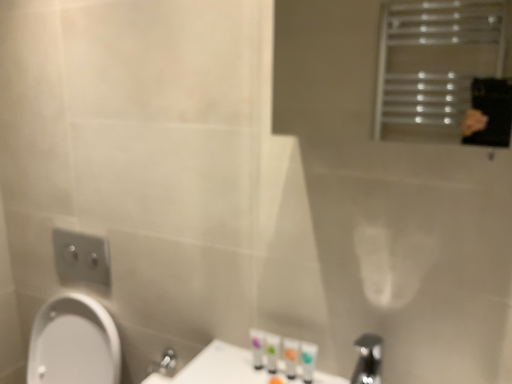
Describe the element at coordinates (434, 65) in the screenshot. The width and height of the screenshot is (512, 384). I see `metallic silver towel rack at upper right` at that location.

Measure the distance between metallic silver towel rack at upper right and camera.

metallic silver towel rack at upper right and camera are 4.90 feet apart from each other.

Locate an element on the screen. Image resolution: width=512 pixels, height=384 pixels. silver metallic tap at lower right is located at coordinates (368, 359).

The width and height of the screenshot is (512, 384). Describe the element at coordinates (272, 351) in the screenshot. I see `translucent plastic tubes at lower center, the 3th toiletry when ordered from right to left` at that location.

Locate an element on the screen. The image size is (512, 384). translucent plastic tubes at lower center, the second toiletry positioned from the right is located at coordinates (290, 357).

What is the approximate height of translucent plastic tubes at lower center, the second toiletry positioned from the right?

translucent plastic tubes at lower center, the second toiletry positioned from the right, is 3.80 inches in height.

The width and height of the screenshot is (512, 384). I want to click on white glossy tube at lower center, the first toiletry viewed from the right, so click(x=308, y=360).

From the picture: Is silver metallic tap at lower right placed right next to white glossy tube at lower center, the first toiletry viewed from the right?

No, silver metallic tap at lower right is not beside white glossy tube at lower center, the first toiletry viewed from the right.

Does silver metallic tap at lower right have a lesser height compared to white glossy tube at lower center, which ranks as the fourth toiletry in left-to-right order?

No.

Considering the relative sizes of silver metallic tap at lower right and white glossy tube at lower center, the first toiletry viewed from the right, in the image provided, is silver metallic tap at lower right bigger than white glossy tube at lower center, the first toiletry viewed from the right,?

Yes, silver metallic tap at lower right is bigger than white glossy tube at lower center, the first toiletry viewed from the right.

From the image's perspective, is silver metallic tap at lower right on white glossy tube at lower center, the first toiletry viewed from the right?

No, from the image's perspective, silver metallic tap at lower right is not on top of white glossy tube at lower center, the first toiletry viewed from the right.

Considering the relative sizes of translucent plastic tubes at lower center, the 2th toiletry in the left-to-right sequence, and white glossy tube at lower center, which ranks as the fourth toiletry in left-to-right order, in the image provided, is translucent plastic tubes at lower center, the 2th toiletry in the left-to-right sequence, taller than white glossy tube at lower center, which ranks as the fourth toiletry in left-to-right order,?

In fact, translucent plastic tubes at lower center, the 2th toiletry in the left-to-right sequence, may be shorter than white glossy tube at lower center, which ranks as the fourth toiletry in left-to-right order.

Is translucent plastic tubes at lower center, the 3th toiletry when ordered from right to left, oriented towards white glossy tube at lower center, the first toiletry viewed from the right?

No, translucent plastic tubes at lower center, the 3th toiletry when ordered from right to left, is not facing towards white glossy tube at lower center, the first toiletry viewed from the right.

From the image's perspective, would you say translucent plastic tubes at lower center, the 3th toiletry when ordered from right to left, is shown under white glossy tube at lower center, which ranks as the fourth toiletry in left-to-right order?

No, from the image's perspective, translucent plastic tubes at lower center, the 3th toiletry when ordered from right to left, is not below white glossy tube at lower center, which ranks as the fourth toiletry in left-to-right order.

Which of these two, metallic silver towel rack at upper right or translucent plastic tubes at lower center, acting as the 3th toiletry starting from the left, is smaller?

translucent plastic tubes at lower center, acting as the 3th toiletry starting from the left, is smaller.

Can you confirm if metallic silver towel rack at upper right is positioned to the right of translucent plastic tubes at lower center, the second toiletry positioned from the right?

Indeed, metallic silver towel rack at upper right is positioned on the right side of translucent plastic tubes at lower center, the second toiletry positioned from the right.

Between metallic silver towel rack at upper right and translucent plastic tubes at lower center, the second toiletry positioned from the right, which one is positioned in front?

metallic silver towel rack at upper right.

From a real-world perspective, is silver metallic tap at lower right below translucent plastic tubes at lower center, the 3th toiletry when ordered from right to left?

No, from a real-world perspective, silver metallic tap at lower right is not below translucent plastic tubes at lower center, the 3th toiletry when ordered from right to left.

Would you say silver metallic tap at lower right is outside translucent plastic tubes at lower center, the 3th toiletry when ordered from right to left?

Yes, silver metallic tap at lower right is not within translucent plastic tubes at lower center, the 3th toiletry when ordered from right to left.

Considering the sizes of silver metallic tap at lower right and translucent plastic tubes at lower center, the 3th toiletry when ordered from right to left, in the image, is silver metallic tap at lower right wider or thinner than translucent plastic tubes at lower center, the 3th toiletry when ordered from right to left,?

Considering their sizes, silver metallic tap at lower right looks broader than translucent plastic tubes at lower center, the 3th toiletry when ordered from right to left.

Is the surface of silver metallic tap at lower right in direct contact with translucent plastic tubes at lower center, the 3th toiletry when ordered from right to left?

There is a gap between silver metallic tap at lower right and translucent plastic tubes at lower center, the 3th toiletry when ordered from right to left.

Can you tell me how much translucent plastic tubes at lower center, the 3th toiletry when ordered from right to left, and translucent plastic tubes at lower center, acting as the 3th toiletry starting from the left, differ in facing direction?

3.1 degrees separate the facing orientations of translucent plastic tubes at lower center, the 3th toiletry when ordered from right to left, and translucent plastic tubes at lower center, acting as the 3th toiletry starting from the left.

Based on the photo, from the image's perspective, would you say translucent plastic tubes at lower center, the 2th toiletry in the left-to-right sequence, is shown under translucent plastic tubes at lower center, the second toiletry positioned from the right?

Actually, translucent plastic tubes at lower center, the 2th toiletry in the left-to-right sequence, appears above translucent plastic tubes at lower center, the second toiletry positioned from the right, in the image.

From the picture: Is translucent plastic tubes at lower center, the 2th toiletry in the left-to-right sequence, aimed at translucent plastic tubes at lower center, the second toiletry positioned from the right?

No, translucent plastic tubes at lower center, the 2th toiletry in the left-to-right sequence, is not oriented towards translucent plastic tubes at lower center, the second toiletry positioned from the right.

Is translucent plastic tubes at lower center, the 2th toiletry in the left-to-right sequence, wider than translucent plastic tubes at lower center, the second toiletry positioned from the right?

Yes.

Is translucent plastic tubes at lower center, the second toiletry positioned from the right, far away from translucent plastic bottles at lower center, acting as the 4th toiletry starting from the right?

No, translucent plastic tubes at lower center, the second toiletry positioned from the right, is in close proximity to translucent plastic bottles at lower center, acting as the 4th toiletry starting from the right.

Is translucent plastic tubes at lower center, acting as the 3th toiletry starting from the left, positioned beyond the bounds of translucent plastic bottles at lower center, acting as the 4th toiletry starting from the right?

Yes, translucent plastic tubes at lower center, acting as the 3th toiletry starting from the left, is outside of translucent plastic bottles at lower center, acting as the 4th toiletry starting from the right.

Based on the photo, who is shorter, translucent plastic tubes at lower center, acting as the 3th toiletry starting from the left, or translucent plastic bottles at lower center, which is the first toiletry in left-to-right order?

With less height is translucent plastic bottles at lower center, which is the first toiletry in left-to-right order.

Which object is more forward, translucent plastic tubes at lower center, acting as the 3th toiletry starting from the left, or translucent plastic bottles at lower center, acting as the 4th toiletry starting from the right?

translucent plastic tubes at lower center, acting as the 3th toiletry starting from the left, is closer to the camera.

Is metallic silver towel rack at upper right at the right side of silver metallic tap at lower right?

Yes.

Is there a large distance between metallic silver towel rack at upper right and silver metallic tap at lower right?

Indeed, metallic silver towel rack at upper right is not near silver metallic tap at lower right.

From a real-world perspective, is metallic silver towel rack at upper right physically below silver metallic tap at lower right?

Actually, metallic silver towel rack at upper right is physically above silver metallic tap at lower right in the real world.

Where is `tap that is in front of the white glossy tube at lower center, which ranks as the fourth toiletry in left-to-right order`? tap that is in front of the white glossy tube at lower center, which ranks as the fourth toiletry in left-to-right order is located at coordinates (368, 359).

Where is `toiletry that is the 2nd object located below the translucent plastic tubes at lower center, the 3th toiletry when ordered from right to left (from the image's perspective)`? The image size is (512, 384). toiletry that is the 2nd object located below the translucent plastic tubes at lower center, the 3th toiletry when ordered from right to left (from the image's perspective) is located at coordinates point(308,360).

From the picture: When comparing their distances from translucent plastic bottles at lower center, which is the first toiletry in left-to-right order, does translucent plastic tubes at lower center, acting as the 3th toiletry starting from the left, or translucent plastic tubes at lower center, the 2th toiletry in the left-to-right sequence, seem closer?

translucent plastic tubes at lower center, the 2th toiletry in the left-to-right sequence.

Based on their spatial positions, is translucent plastic tubes at lower center, the 2th toiletry in the left-to-right sequence, or translucent plastic tubes at lower center, acting as the 3th toiletry starting from the left, further from metallic silver towel rack at upper right?

The object further to metallic silver towel rack at upper right is translucent plastic tubes at lower center, the 2th toiletry in the left-to-right sequence.

When comparing their distances from silver metallic tap at lower right, does translucent plastic bottles at lower center, which is the first toiletry in left-to-right order, or metallic silver towel rack at upper right seem further?

metallic silver towel rack at upper right is further to silver metallic tap at lower right.

Looking at the image, which one is located further to metallic silver towel rack at upper right, translucent plastic tubes at lower center, acting as the 3th toiletry starting from the left, or translucent plastic bottles at lower center, which is the first toiletry in left-to-right order?

translucent plastic bottles at lower center, which is the first toiletry in left-to-right order, is positioned further to the anchor metallic silver towel rack at upper right.

In the scene shown: Which object lies further to the anchor point translucent plastic tubes at lower center, the 3th toiletry when ordered from right to left, white glossy tube at lower center, which ranks as the fourth toiletry in left-to-right order, or translucent plastic bottles at lower center, acting as the 4th toiletry starting from the right?

white glossy tube at lower center, which ranks as the fourth toiletry in left-to-right order, lies further to translucent plastic tubes at lower center, the 3th toiletry when ordered from right to left, than the other object.

When comparing their distances from white glossy tube at lower center, which ranks as the fourth toiletry in left-to-right order, does translucent plastic tubes at lower center, the second toiletry positioned from the right, or translucent plastic bottles at lower center, which is the first toiletry in left-to-right order, seem further?

Based on the image, translucent plastic bottles at lower center, which is the first toiletry in left-to-right order, appears to be further to white glossy tube at lower center, which ranks as the fourth toiletry in left-to-right order.

Looking at the image, which one is located closer to translucent plastic tubes at lower center, the 3th toiletry when ordered from right to left, white glossy tube at lower center, the first toiletry viewed from the right, or silver metallic tap at lower right?

white glossy tube at lower center, the first toiletry viewed from the right, is closer to translucent plastic tubes at lower center, the 3th toiletry when ordered from right to left.

From the picture: From the image, which object appears to be farther from translucent plastic tubes at lower center, the 2th toiletry in the left-to-right sequence, metallic silver towel rack at upper right or white glossy tube at lower center, which ranks as the fourth toiletry in left-to-right order?

The object further to translucent plastic tubes at lower center, the 2th toiletry in the left-to-right sequence, is metallic silver towel rack at upper right.

This screenshot has height=384, width=512. I want to click on toiletry between metallic silver towel rack at upper right and translucent plastic tubes at lower center, the 2th toiletry in the left-to-right sequence, from top to bottom, so click(257, 347).

The image size is (512, 384). Find the location of `toiletry between translucent plastic tubes at lower center, the 3th toiletry when ordered from right to left, and white glossy tube at lower center, the first toiletry viewed from the right`. toiletry between translucent plastic tubes at lower center, the 3th toiletry when ordered from right to left, and white glossy tube at lower center, the first toiletry viewed from the right is located at coordinates (290, 357).

Where is `toiletry between silver metallic tap at lower right and translucent plastic tubes at lower center, acting as the 3th toiletry starting from the left, in the front-back direction`? toiletry between silver metallic tap at lower right and translucent plastic tubes at lower center, acting as the 3th toiletry starting from the left, in the front-back direction is located at coordinates (308, 360).

Identify the location of toiletry between translucent plastic bottles at lower center, acting as the 4th toiletry starting from the right, and translucent plastic tubes at lower center, the second toiletry positioned from the right. Image resolution: width=512 pixels, height=384 pixels. (272, 351).